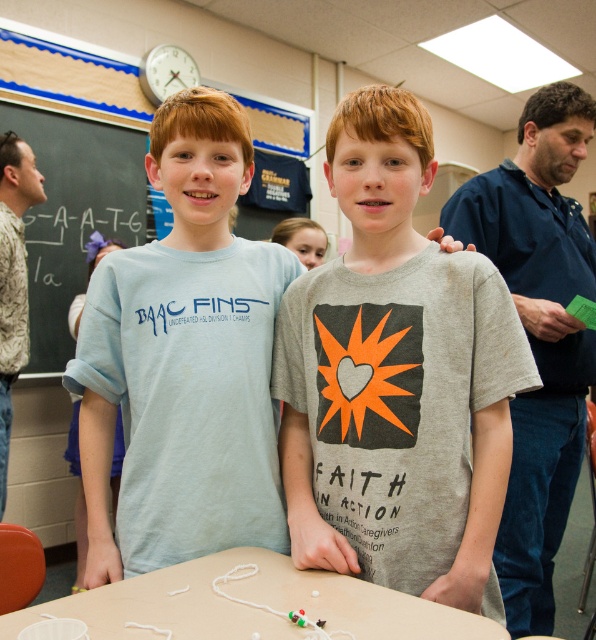
Which is more to the left, gray matte t-shirt at center or gray cotton shirt at right?

Positioned to the left is gray matte t-shirt at center.

The height and width of the screenshot is (640, 596). What are the coordinates of `gray matte t-shirt at center` in the screenshot? It's located at (396, 380).

Between point (458, 595) and point (544, 278), which one is positioned behind?

Point (544, 278)

Find the location of a particular element. This screenshot has height=640, width=596. gray matte t-shirt at center is located at coordinates (396, 380).

Locate an element on the screen. The image size is (596, 640). gray matte t-shirt at center is located at coordinates (396, 380).

Describe the element at coordinates (396, 380) in the screenshot. The height and width of the screenshot is (640, 596). I see `gray matte t-shirt at center` at that location.

Describe the element at coordinates (396, 380) in the screenshot. Image resolution: width=596 pixels, height=640 pixels. I see `gray matte t-shirt at center` at that location.

Where is `gray matte t-shirt at center`? The image size is (596, 640). gray matte t-shirt at center is located at coordinates (396, 380).

Does light blue cotton shirt at center appear over wooden table at center?

Yes.

Does light blue cotton shirt at center have a greater height compared to wooden table at center?

Correct, light blue cotton shirt at center is much taller as wooden table at center.

Does point (122, 257) come behind point (187, 618)?

Yes, point (122, 257) is farther from viewer.

What are the coordinates of `light blue cotton shirt at center` in the screenshot? It's located at (184, 360).